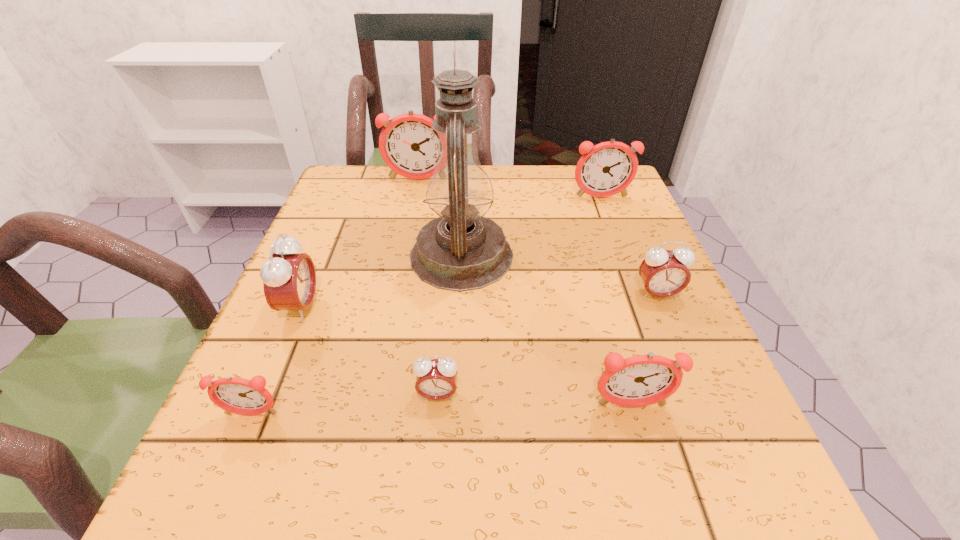
Identify which reddish-pink alarm clock is the third nearest to the second smallest pink alarm clock. Please provide its 2D coordinates. Your answer should be formatted as a tuple, i.e. [(x, y)], where the tuple contains the x and y coordinates of a point satisfying the conditions above.

[(409, 146)]

Identify which reddish-pink alarm clock is the fourth nearest to the second smallest pink alarm clock. Please provide its 2D coordinates. Your answer should be formatted as a tuple, i.e. [(x, y)], where the tuple contains the x and y coordinates of a point satisfying the conditions above.

[(235, 395)]

Select which pink alarm clock appears as the closest to the leftmost reddish-pink alarm clock. Please provide its 2D coordinates. Your answer should be formatted as a tuple, i.e. [(x, y)], where the tuple contains the x and y coordinates of a point satisfying the conditions above.

[(289, 278)]

Select which pink alarm clock appears as the second closest to the tallest object. Please provide its 2D coordinates. Your answer should be formatted as a tuple, i.e. [(x, y)], where the tuple contains the x and y coordinates of a point satisfying the conditions above.

[(436, 379)]

Locate an element on the screen. This screenshot has height=540, width=960. vacant space that satisfies the following two spatial constraints: 1. on the front-facing side of the seventh shortest object; 2. on the clock face of the biggest pink alarm clock is located at coordinates (392, 307).

Where is `vacant point that satisfies the following two spatial constraints: 1. on the front-facing side of the oil lamp; 2. on the right side of the seventh shortest object`? The image size is (960, 540). vacant point that satisfies the following two spatial constraints: 1. on the front-facing side of the oil lamp; 2. on the right side of the seventh shortest object is located at coordinates (402, 256).